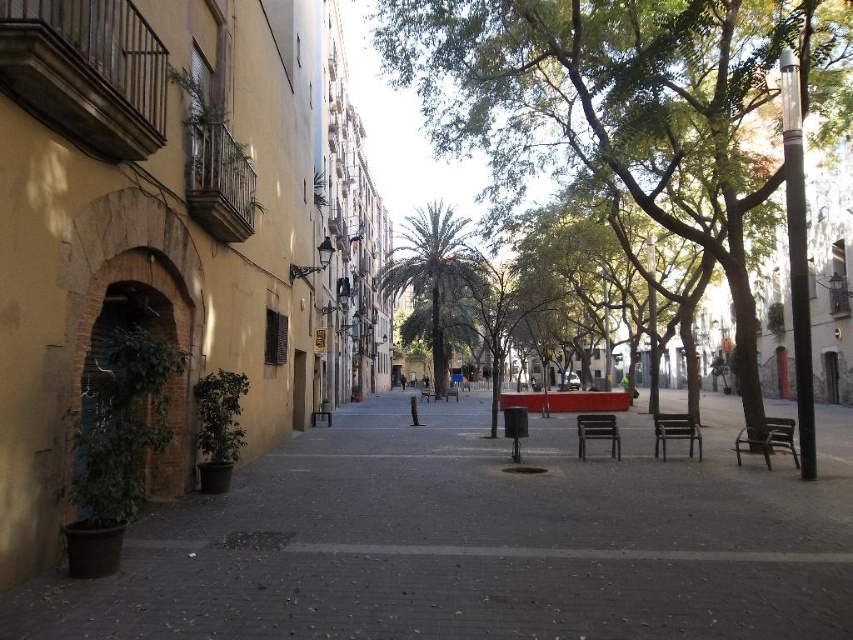
You are standing in the plaza and want to find a taller tree to rest under. Which tree should you choose between the green leafy tree at center and the green leafy palm tree at center?

The green leafy palm tree at center is taller than the green leafy tree at center, so you should choose the green leafy palm tree at center to rest under.

You are standing at the center of the plaza and see two points marked in the image. Which point is closer to you, point (430, 326) or point (422, 385)?

Point (430, 326) is in front of point (422, 385), so it is closer to you.

You are standing in the plaza and want to take a photo of the green leafy tree at center. If your camera has a maximum focus range of 30 feet, will you be able to capture the tree clearly?

The green leafy tree at center is 30.95 feet away from the viewer. Since the camera can only focus up to 30 feet, it won cannot capture the tree clearly.